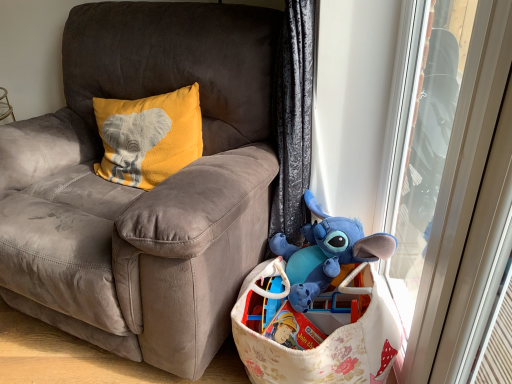
The width and height of the screenshot is (512, 384). Describe the element at coordinates (326, 253) in the screenshot. I see `blue plush toy at lower right` at that location.

What do you see at coordinates (324, 340) in the screenshot?
I see `fluffy white fabric basket at lower right` at bounding box center [324, 340].

What do you see at coordinates (457, 186) in the screenshot? I see `transparent plastic screen door at right` at bounding box center [457, 186].

The width and height of the screenshot is (512, 384). In order to click on suede gray chair at center in this screenshot , I will do `click(142, 191)`.

From the image's perspective, who appears lower, suede gray chair at center or transparent plastic screen door at right?

transparent plastic screen door at right, from the image's perspective.

Is suede gray chair at center facing towards transparent plastic screen door at right?

No, suede gray chair at center is not turned towards transparent plastic screen door at right.

Relative to transparent plastic screen door at right, is suede gray chair at center in front or behind?

suede gray chair at center is in front of transparent plastic screen door at right.

Which is in front, point (200, 15) or point (250, 298)?

The point (250, 298) is closer.

At what (x,y) coordinates should I click in order to perform the action: click on shopping bag to the right of suede gray chair at center. Please return your answer as a coordinate pair (x, y). Looking at the image, I should click on (324, 340).

In terms of height, does suede gray chair at center look taller or shorter compared to fluffy white fabric basket at lower right?

suede gray chair at center is taller than fluffy white fabric basket at lower right.

From the image's perspective, which one is positioned lower, suede gray chair at center or fluffy white fabric basket at lower right?

fluffy white fabric basket at lower right.

I want to click on shopping bag beneath the suede gray chair at center (from a real-world perspective), so click(324, 340).

From a real-world perspective, is fluffy white fabric basket at lower right on suede gray chair at center?

Actually, fluffy white fabric basket at lower right is physically below suede gray chair at center in the real world.

Based on the photo, considering the sizes of fluffy white fabric basket at lower right and suede gray chair at center in the image, is fluffy white fabric basket at lower right bigger or smaller than suede gray chair at center?

Considering their sizes, fluffy white fabric basket at lower right takes up less space than suede gray chair at center.

Between blue plush toy at lower right and suede gray chair at center, which one has more height?

suede gray chair at center is taller.

This screenshot has width=512, height=384. What are the coordinates of `toy behind the suede gray chair at center` in the screenshot? It's located at (326, 253).

Are blue plush toy at lower right and suede gray chair at center located far from each other?

Actually, blue plush toy at lower right and suede gray chair at center are a little close together.

Between blue plush toy at lower right and suede gray chair at center, which one has larger width?

Result: suede gray chair at center is wider.

Is fluffy white fabric basket at lower right taller or shorter than transparent plastic screen door at right?

fluffy white fabric basket at lower right is shorter than transparent plastic screen door at right.

The height and width of the screenshot is (384, 512). What are the coordinates of `screen door above the fluffy white fabric basket at lower right (from a real-world perspective)` in the screenshot? It's located at (457, 186).

Is point (304, 380) positioned before point (407, 375)?

Yes.

Considering the relative sizes of fluffy white fabric basket at lower right and transparent plastic screen door at right in the image provided, is fluffy white fabric basket at lower right wider than transparent plastic screen door at right?

Yes.

From a real-world perspective, is blue plush toy at lower right positioned above or below fluffy white fabric basket at lower right?

From a real-world perspective, blue plush toy at lower right is physically above fluffy white fabric basket at lower right.

Are blue plush toy at lower right and fluffy white fabric basket at lower right making contact?

blue plush toy at lower right and fluffy white fabric basket at lower right are not in contact.

Considering the points (357, 235) and (239, 325), which point is in front, point (357, 235) or point (239, 325)?

Positioned in front is point (239, 325).

In terms of width, does blue plush toy at lower right look wider or thinner when compared to fluffy white fabric basket at lower right?

Considering their sizes, blue plush toy at lower right looks slimmer than fluffy white fabric basket at lower right.

Is transparent plastic screen door at right far away from blue plush toy at lower right?

Actually, transparent plastic screen door at right and blue plush toy at lower right are a little close together.

Is transparent plastic screen door at right at the right side of blue plush toy at lower right?

Yes, transparent plastic screen door at right is to the right of blue plush toy at lower right.

Which object is wider, transparent plastic screen door at right or blue plush toy at lower right?

With larger width is blue plush toy at lower right.

Is transparent plastic screen door at right shorter than blue plush toy at lower right?

Incorrect, the height of transparent plastic screen door at right does not fall short of that of blue plush toy at lower right.

Locate an element on the screen. This screenshot has width=512, height=384. screen door that appears above the suede gray chair at center (from a real-world perspective) is located at coordinates (457, 186).

You are a GUI agent. You are given a task and a screenshot of the screen. Output one action in this format:
    pyautogui.click(x=<x>, y=<y>)
    Task: Click on the shopping bag to the right of suede gray chair at center
    
    Given the screenshot: What is the action you would take?
    pyautogui.click(x=324, y=340)

From the picture: Estimate the real-world distances between objects in this image. Which object is closer to fluffy white fabric basket at lower right, blue plush toy at lower right or suede gray chair at center?

blue plush toy at lower right.

Estimate the real-world distances between objects in this image. Which object is further from transparent plastic screen door at right, suede gray chair at center or fluffy white fabric basket at lower right?

suede gray chair at center is further to transparent plastic screen door at right.

Based on their spatial positions, is suede gray chair at center or transparent plastic screen door at right further from blue plush toy at lower right?

Based on the image, suede gray chair at center appears to be further to blue plush toy at lower right.

Which object lies further to the anchor point blue plush toy at lower right, transparent plastic screen door at right or suede gray chair at center?

suede gray chair at center lies further to blue plush toy at lower right than the other object.

Considering their positions, is fluffy white fabric basket at lower right positioned further to suede gray chair at center than transparent plastic screen door at right?

Among the two, transparent plastic screen door at right is located further to suede gray chair at center.

Based on their spatial positions, is fluffy white fabric basket at lower right or suede gray chair at center further from blue plush toy at lower right?

suede gray chair at center.

From the image, which object appears to be farther from fluffy white fabric basket at lower right, transparent plastic screen door at right or blue plush toy at lower right?

transparent plastic screen door at right is positioned further to the anchor fluffy white fabric basket at lower right.

Estimate the real-world distances between objects in this image. Which object is closer to suede gray chair at center, transparent plastic screen door at right or blue plush toy at lower right?

blue plush toy at lower right is positioned closer to the anchor suede gray chair at center.

Find the location of a particular element. This screenshot has width=512, height=384. shopping bag between transparent plastic screen door at right and blue plush toy at lower right in the front-back direction is located at coordinates (324, 340).

Where is `toy situated between suede gray chair at center and transparent plastic screen door at right from left to right`? The height and width of the screenshot is (384, 512). toy situated between suede gray chair at center and transparent plastic screen door at right from left to right is located at coordinates (326, 253).

Locate an element on the screen. This screenshot has height=384, width=512. shopping bag located between suede gray chair at center and blue plush toy at lower right in the left-right direction is located at coordinates (324, 340).

Find the location of a particular element. shopping bag between suede gray chair at center and transparent plastic screen door at right is located at coordinates (324, 340).